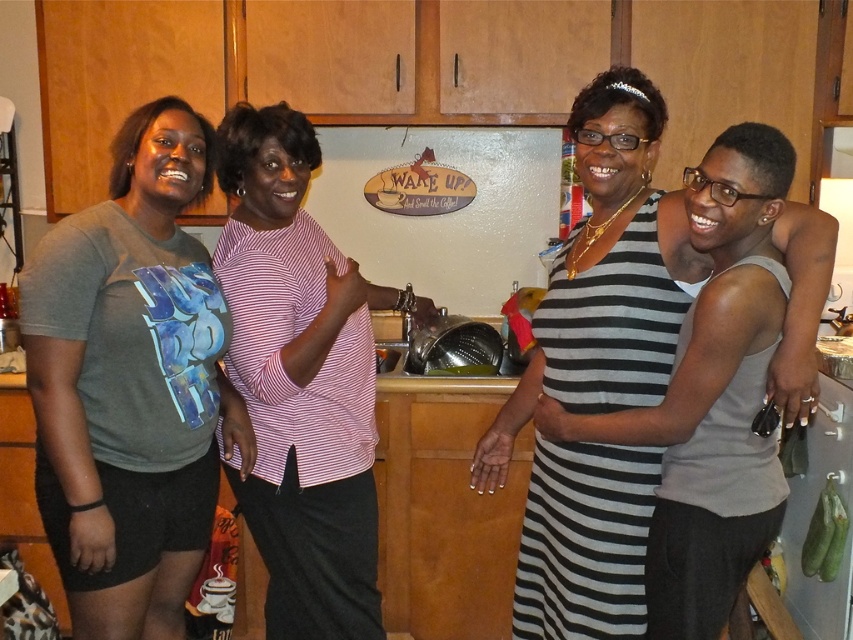
Question: Which is nearer to the pink striped shirt at center?

Choices:
 (A) black and white striped dress at center
 (B) matte gray t-shirt at left

Answer: (B)

Question: Is black and white striped dress at center to the right of pink striped shirt at center from the viewer's perspective?

Choices:
 (A) yes
 (B) no

Answer: (A)

Question: Can you confirm if black and white striped dress at center is bigger than pink striped shirt at center?

Choices:
 (A) no
 (B) yes

Answer: (A)

Question: Based on their relative distances, which object is farther from the black and white striped dress at center?

Choices:
 (A) matte gray t-shirt at left
 (B) pink striped shirt at center

Answer: (A)

Question: Considering the real-world distances, which object is closest to the pink striped shirt at center?

Choices:
 (A) matte gray t-shirt at left
 (B) black and white striped dress at center

Answer: (A)

Question: Does matte gray t-shirt at left appear over black and white striped dress at center?

Choices:
 (A) no
 (B) yes

Answer: (B)